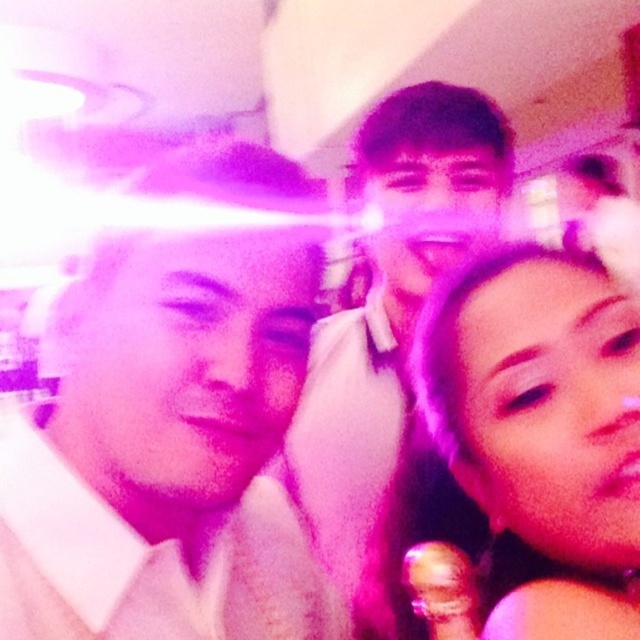
You are holding a camera and want to take a photo of the scene. The camera has a focus range of 50 to 60 centimeters. Is the point at coordinates point (433,365) within the focus range of the camera?

The distance between point (433,365) and the camera is 56.00 centimeters, which falls within the camera focus range of 50 to 60 centimeters. Therefore, the point (433,365) is within the focus range.

From the picture: You are at a party and want to take a photo of the matte pink hair at center and the matte white shirt at center. Which object is closer to the camera in the image?

The matte white shirt at center is closer to the camera because the matte pink hair at center is positioned under it, meaning the shirt is in front.